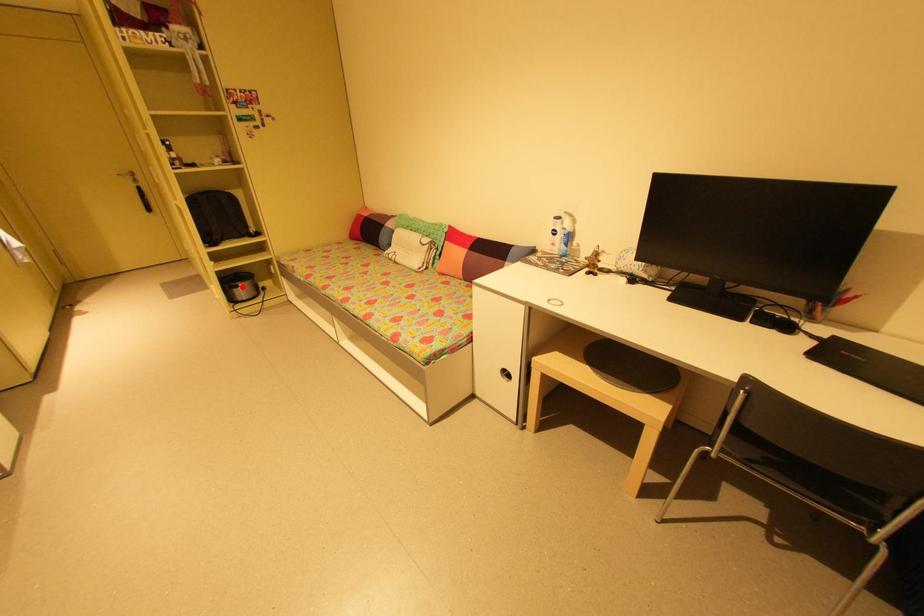
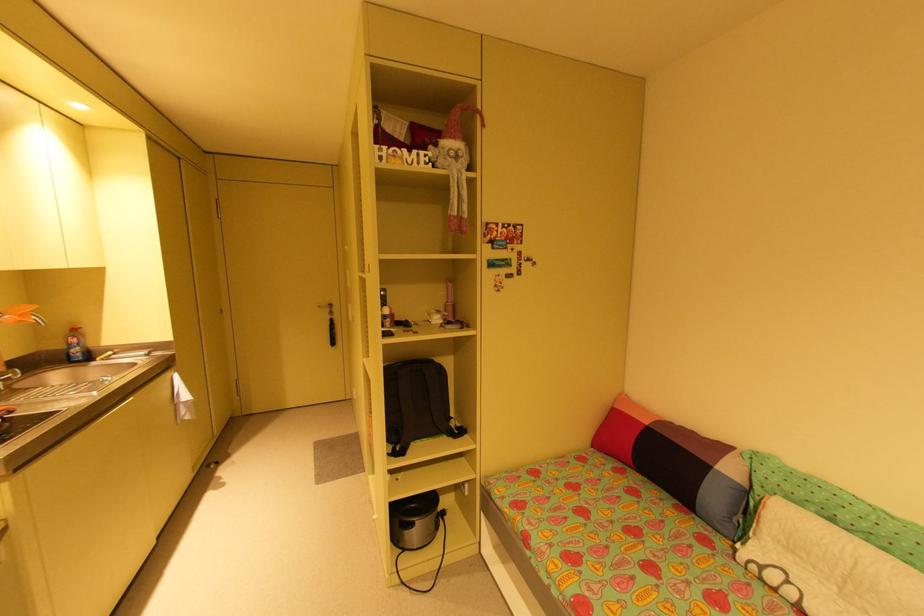
Where in the second image is the point corresponding to the highlighted location from the first image?

(417, 525)